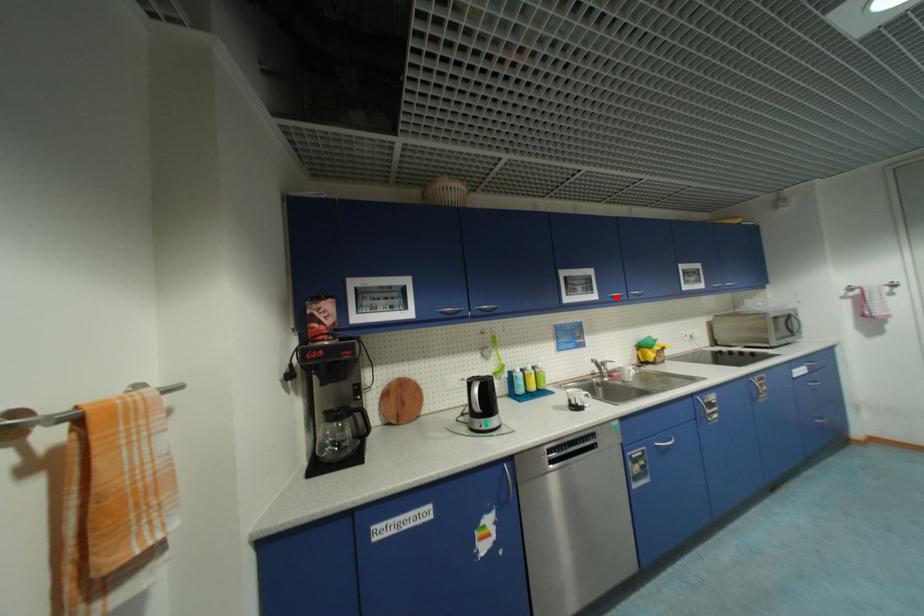
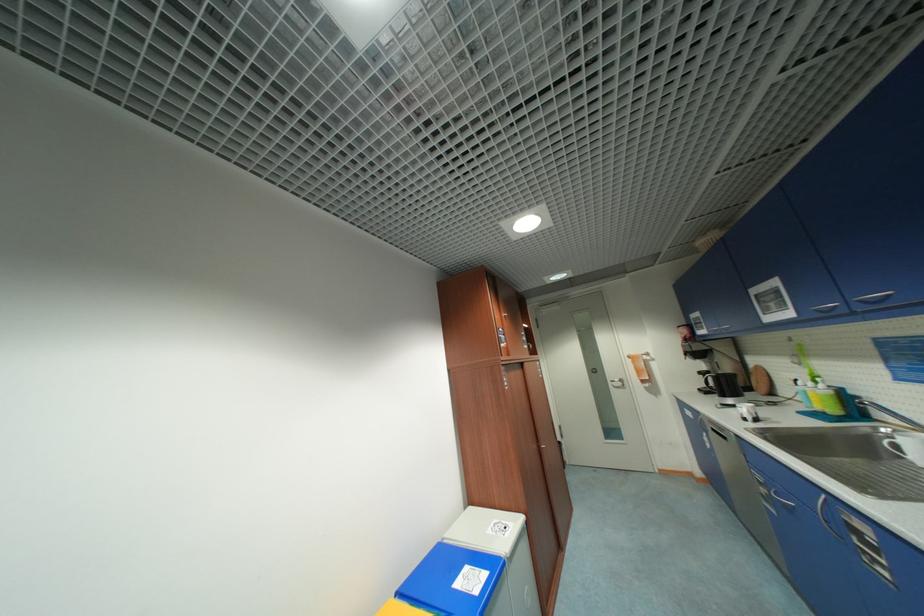
Where in the second image is the point corresponding to the highlighted location from the first image?

(822, 312)